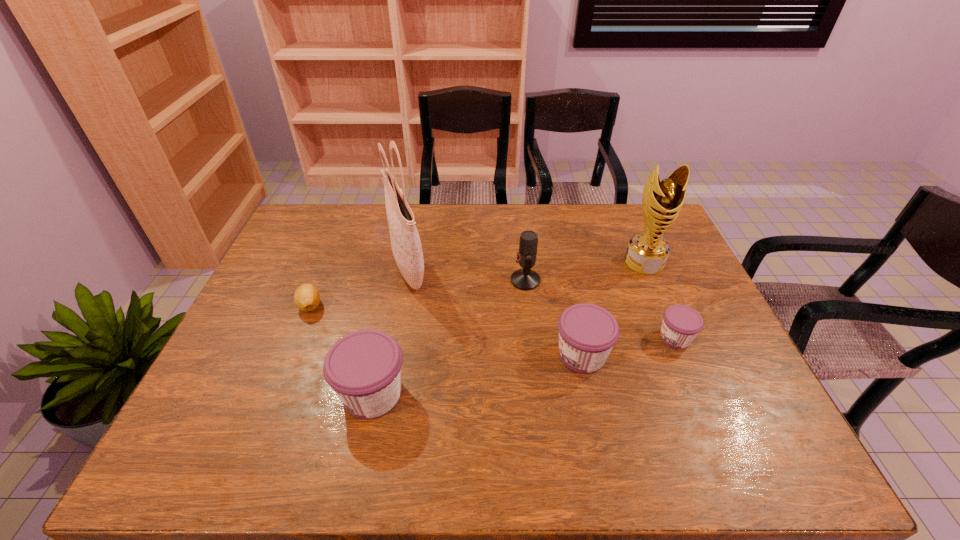
Find the location of a particular element. The image size is (960, 540). the leftmost jam is located at coordinates [x=363, y=367].

Locate an element on the screen. This screenshot has width=960, height=540. the third shortest object is located at coordinates (587, 333).

In order to click on the third object from right to left in this screenshot , I will do (587, 333).

Find the location of `the second shortest object`. the second shortest object is located at coordinates (681, 324).

You are a GUI agent. You are given a task and a screenshot of the screen. Output one action in this format:
    pyautogui.click(x=<x>, y=<y>)
    Task: Click on the rightmost jam
    
    Given the screenshot: What is the action you would take?
    tap(681, 324)

This screenshot has height=540, width=960. I want to click on the shortest object, so click(306, 297).

Find the location of a particular element. lemon is located at coordinates (306, 297).

This screenshot has height=540, width=960. In order to click on the sixth shortest object in this screenshot , I will do `click(647, 252)`.

Where is `the third tallest object`? This screenshot has width=960, height=540. the third tallest object is located at coordinates (524, 279).

Locate an element on the screen. Image resolution: width=960 pixels, height=540 pixels. the fourth object from right to left is located at coordinates (524, 279).